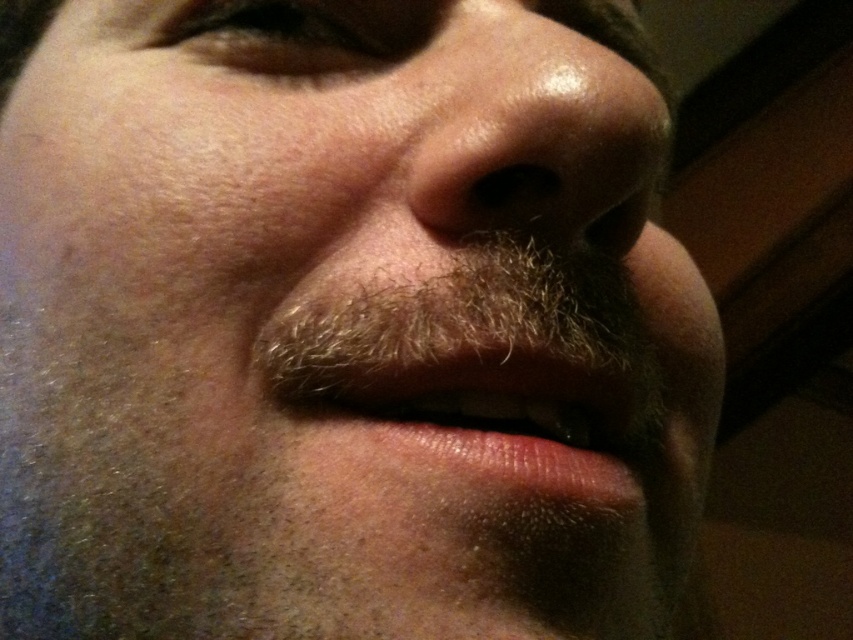
Question: Based on their relative distances, which object is farther from the smooth skin mouth at center?

Choices:
 (A) brown textured eye at upper center
 (B) shiny skin nose at center

Answer: (A)

Question: Among these objects, which one is nearest to the camera?

Choices:
 (A) brown textured eye at upper center
 (B) smooth skin mouth at center

Answer: (B)

Question: Is smooth skin mouth at center to the left of brown textured eye at upper center from the viewer's perspective?

Choices:
 (A) no
 (B) yes

Answer: (A)

Question: Which point is closer to the camera?

Choices:
 (A) brown textured eye at upper center
 (B) smooth skin mouth at center

Answer: (B)

Question: Is shiny skin nose at center bigger than brown textured eye at upper center?

Choices:
 (A) yes
 (B) no

Answer: (A)

Question: Is shiny skin nose at center to the right of brown textured eye at upper center from the viewer's perspective?

Choices:
 (A) no
 (B) yes

Answer: (B)